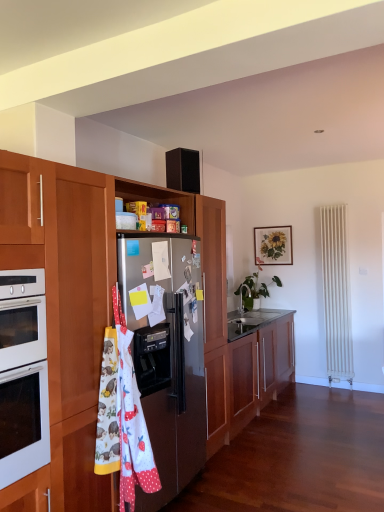
Where is `free space to the right of satin metallic refrigerator at center-left`? This screenshot has width=384, height=512. free space to the right of satin metallic refrigerator at center-left is located at coordinates (251, 483).